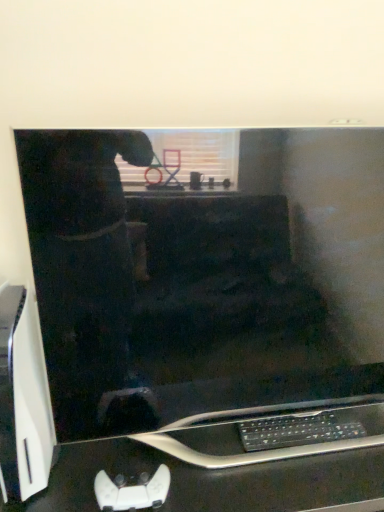
Question: From the image's perspective, would you say black glossy computer desk at lower center is positioned over black plastic keyboard at lower center?

Choices:
 (A) no
 (B) yes

Answer: (A)

Question: Does black glossy computer desk at lower center lie behind black plastic keyboard at lower center?

Choices:
 (A) yes
 (B) no

Answer: (B)

Question: Is black glossy computer desk at lower center facing away from black plastic keyboard at lower center?

Choices:
 (A) yes
 (B) no

Answer: (B)

Question: Considering the relative sizes of black glossy computer desk at lower center and black plastic keyboard at lower center in the image provided, is black glossy computer desk at lower center wider than black plastic keyboard at lower center?

Choices:
 (A) yes
 (B) no

Answer: (A)

Question: Is black glossy computer desk at lower center taller than black plastic keyboard at lower center?

Choices:
 (A) no
 (B) yes

Answer: (B)

Question: Is the depth of black glossy computer desk at lower center less than that of black plastic keyboard at lower center?

Choices:
 (A) no
 (B) yes

Answer: (B)

Question: Is black glossy computer desk at lower center at the back of black plastic keyboard at lower center?

Choices:
 (A) no
 (B) yes

Answer: (B)

Question: Does black plastic keyboard at lower center appear on the left side of black glossy computer desk at lower center?

Choices:
 (A) no
 (B) yes

Answer: (A)

Question: Does black plastic keyboard at lower center have a smaller size compared to black glossy computer desk at lower center?

Choices:
 (A) yes
 (B) no

Answer: (A)

Question: Is black plastic keyboard at lower center behind black glossy computer desk at lower center?

Choices:
 (A) no
 (B) yes

Answer: (B)

Question: Can you confirm if black plastic keyboard at lower center is wider than black glossy computer desk at lower center?

Choices:
 (A) no
 (B) yes

Answer: (A)

Question: Are black plastic keyboard at lower center and black glossy computer desk at lower center far apart?

Choices:
 (A) no
 (B) yes

Answer: (A)

Question: Is black plastic keyboard at lower center in front of or behind black glossy computer desk at lower center in the image?

Choices:
 (A) front
 (B) behind

Answer: (B)